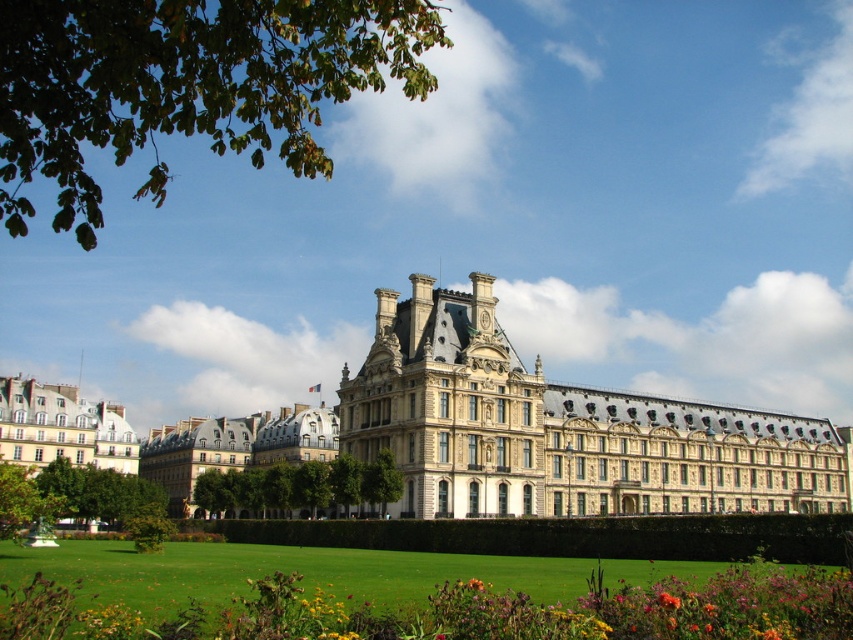
Is green leafy tree at center in front of orange matte flower at lower right?

No.

The height and width of the screenshot is (640, 853). What do you see at coordinates (300, 486) in the screenshot?
I see `green leafy tree at center` at bounding box center [300, 486].

This screenshot has height=640, width=853. I want to click on green leafy tree at center, so click(x=300, y=486).

Can you confirm if green grass at lower center is wider than white stone building at lower left?

Yes, green grass at lower center is wider than white stone building at lower left.

Is green grass at lower center taller than white stone building at lower left?

No.

Identify the location of green grass at lower center. (630, 609).

Is green grass at lower center behind green leafy tree at center?

That is False.

Based on the photo, who is positioned more to the right, green grass at lower center or green leafy tree at center?

green grass at lower center is more to the right.

Who is more distant from viewer, (622, 580) or (260, 497)?

Point (260, 497)

Identify the location of green grass at lower center. (630, 609).